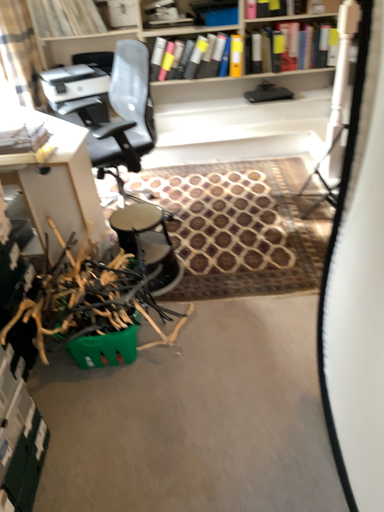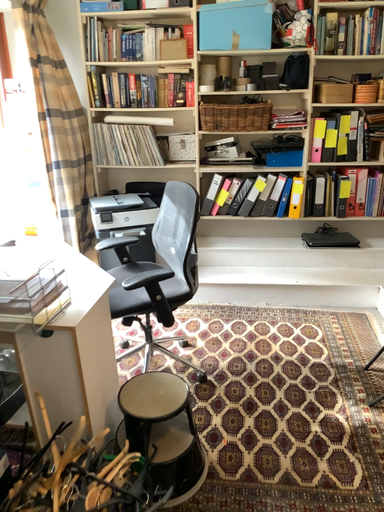
Question: How did the camera likely rotate when shooting the video?

Choices:
 (A) rotated downward
 (B) rotated upward

Answer: (B)